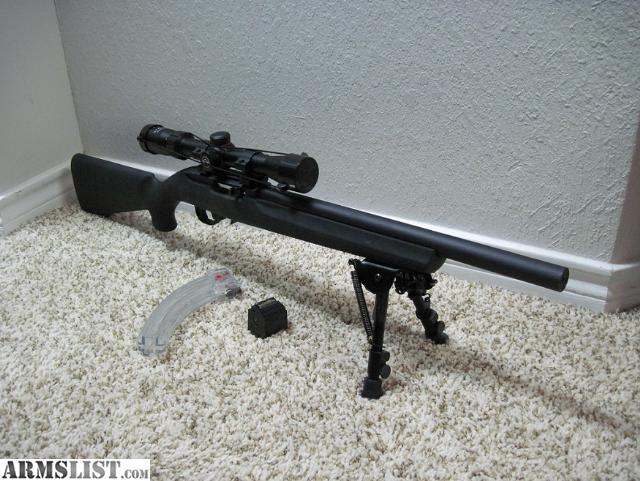
What are the coordinates of `floorboard behind gun` in the screenshot? It's located at (29, 197).